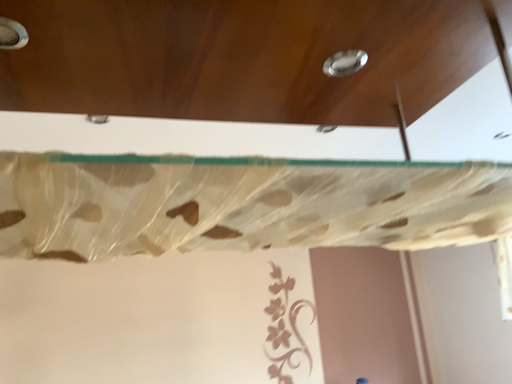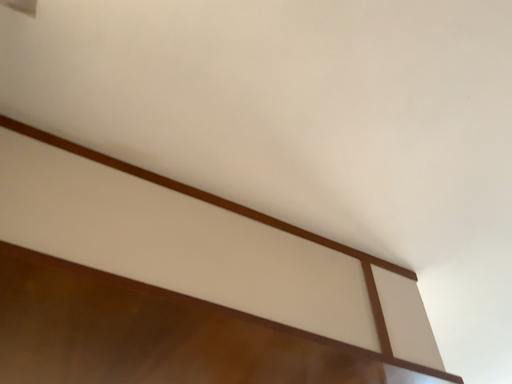
Question: How did the camera likely rotate when shooting the video?

Choices:
 (A) rotated left
 (B) rotated right

Answer: (B)